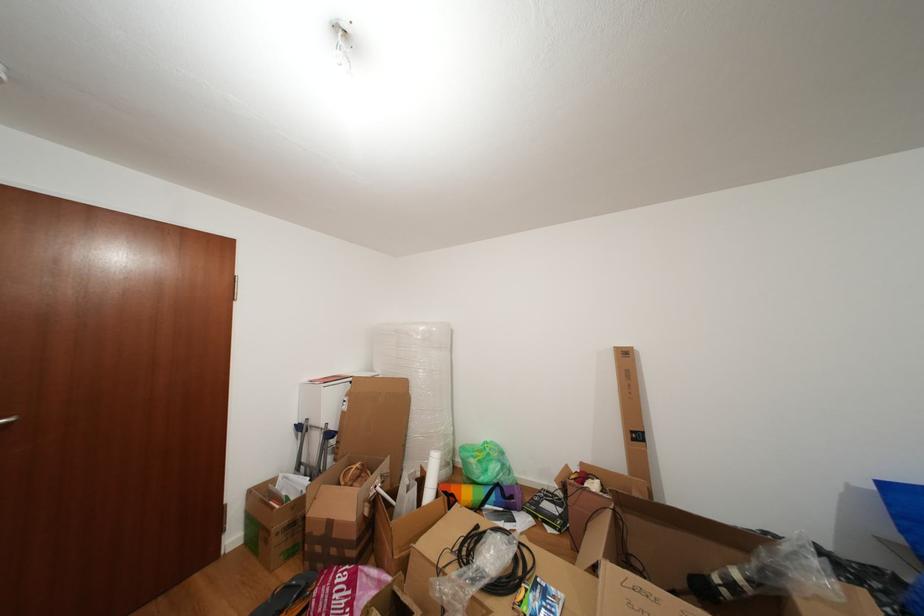
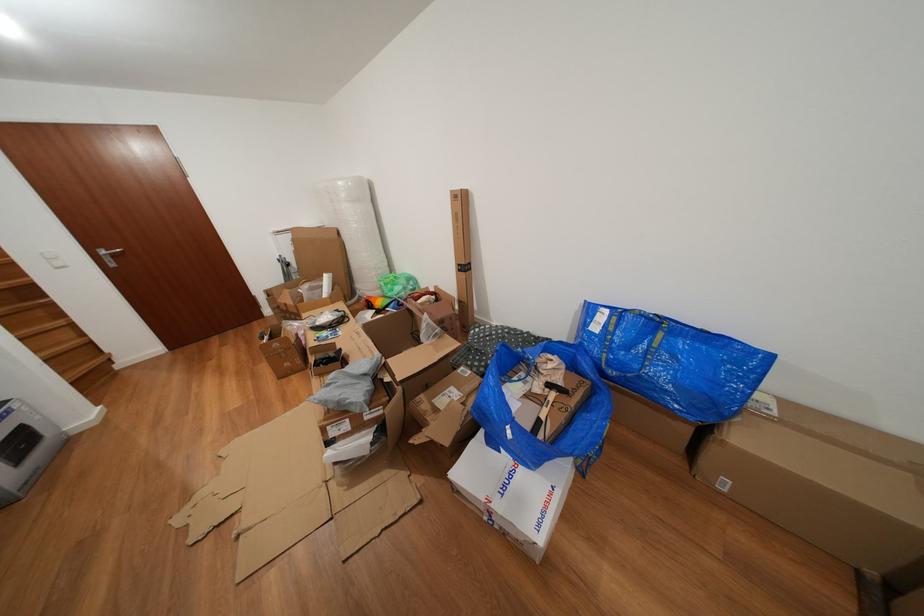
Where in the second image is the point corresponding to (x=641, y=445) from the first image?

(468, 276)